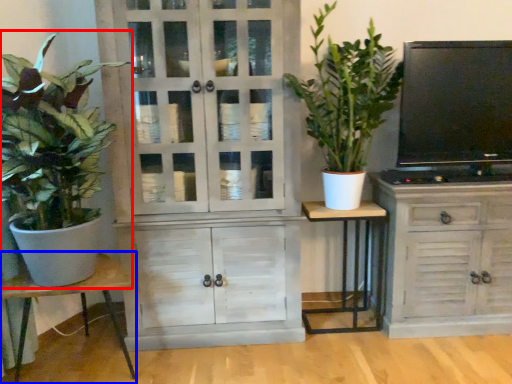
Question: Among these objects, which one is nearest to the camera, houseplant (highlighted by a red box) or table (highlighted by a blue box)?

Choices:
 (A) houseplant
 (B) table

Answer: (A)